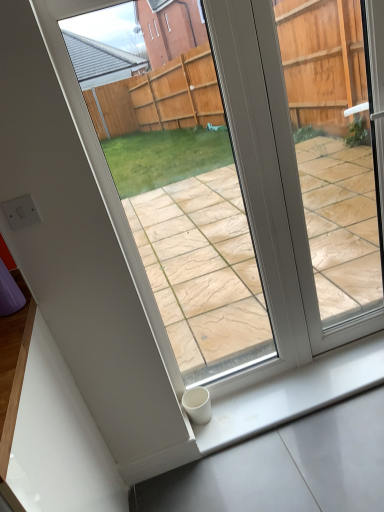
This screenshot has width=384, height=512. What are the coordinates of `empty space that is ontop of white glossy window sill at lower right (from a real-world perspective)` in the screenshot? It's located at (251, 401).